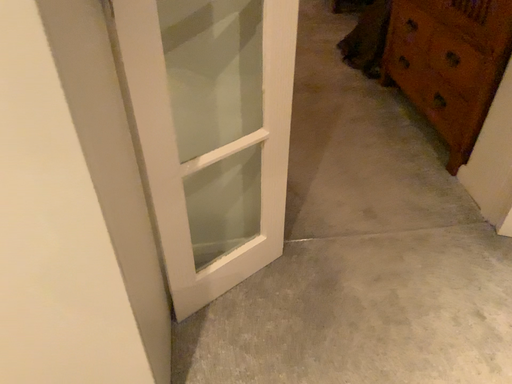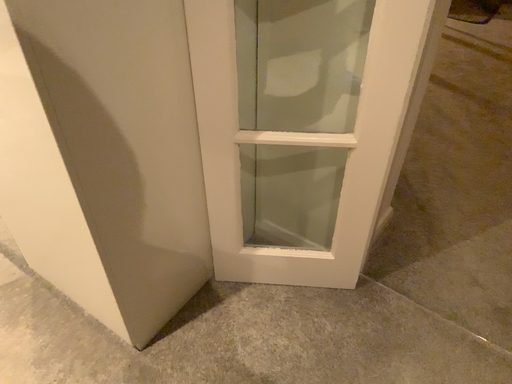
Question: How did the camera likely rotate when shooting the video?

Choices:
 (A) rotated right
 (B) rotated left

Answer: (B)